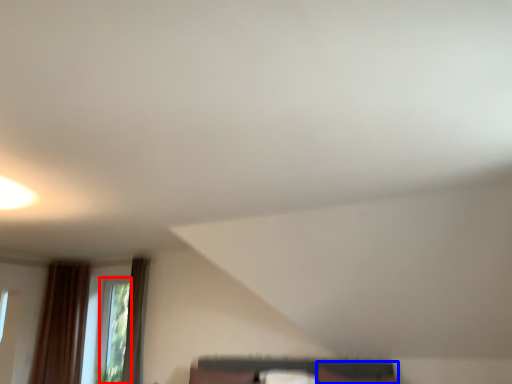
Question: Among these objects, which one is nearest to the camera, window (highlighted by a red box) or furniture (highlighted by a blue box)?

Choices:
 (A) window
 (B) furniture

Answer: (B)